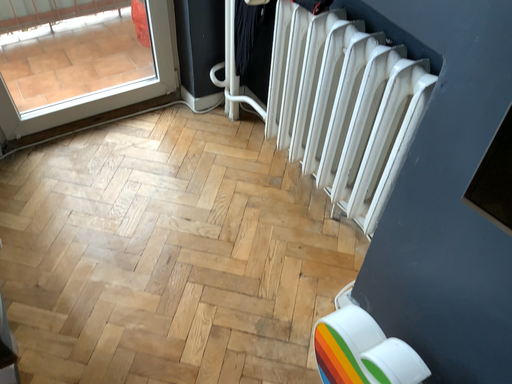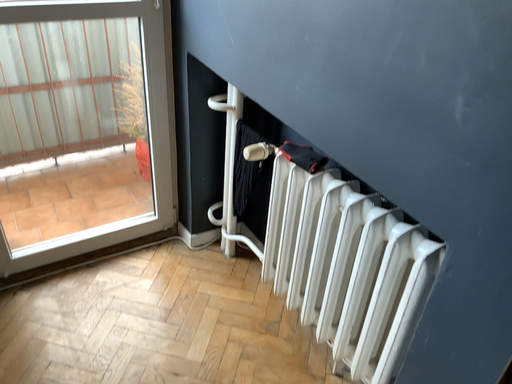
Question: Which way did the camera rotate in the video?

Choices:
 (A) rotated downward
 (B) rotated upward

Answer: (B)